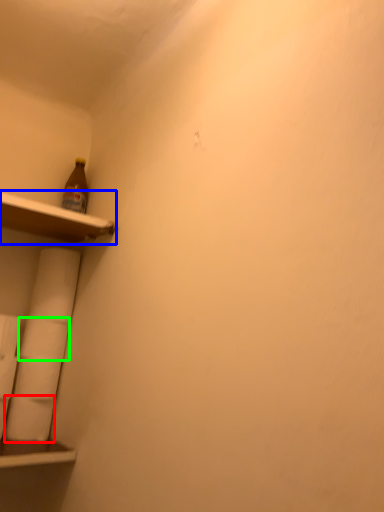
Question: Which object is positioned farthest from toilet paper (highlighted by a red box)? Select from shelf (highlighted by a blue box) and toilet paper (highlighted by a green box).

Choices:
 (A) shelf
 (B) toilet paper

Answer: (A)